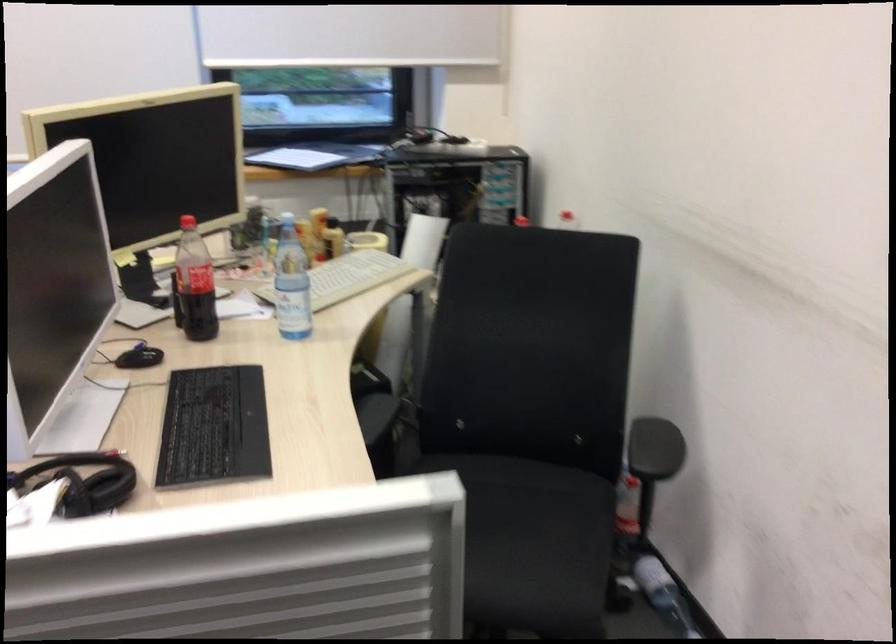
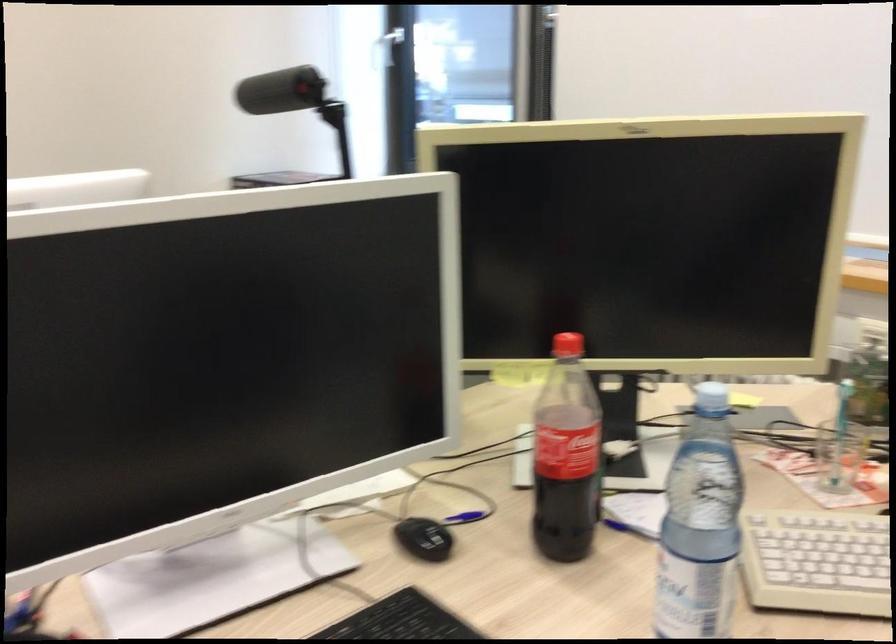
In the second image, find the point that corresponds to pixel 138 362 in the first image.

(424, 538)